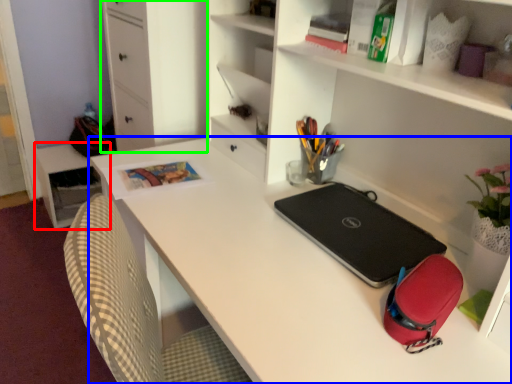
Question: Based on their relative distances, which object is farther from table (highlighted by a red box)? Choose from desk (highlighted by a blue box) and file cabinet (highlighted by a green box).

Choices:
 (A) desk
 (B) file cabinet

Answer: (A)